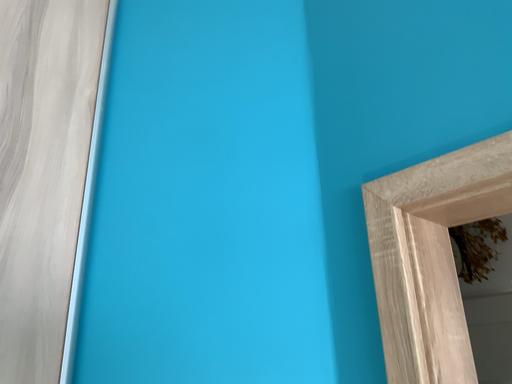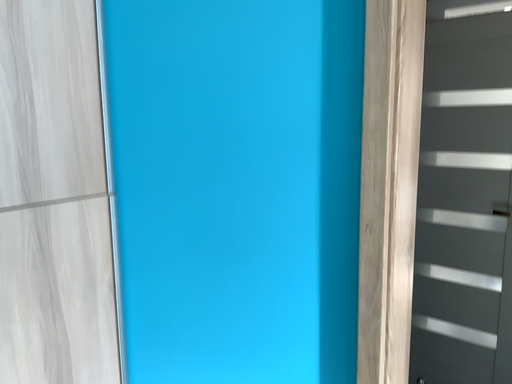
Question: How did the camera likely rotate when shooting the video?

Choices:
 (A) rotated left
 (B) rotated right

Answer: (B)